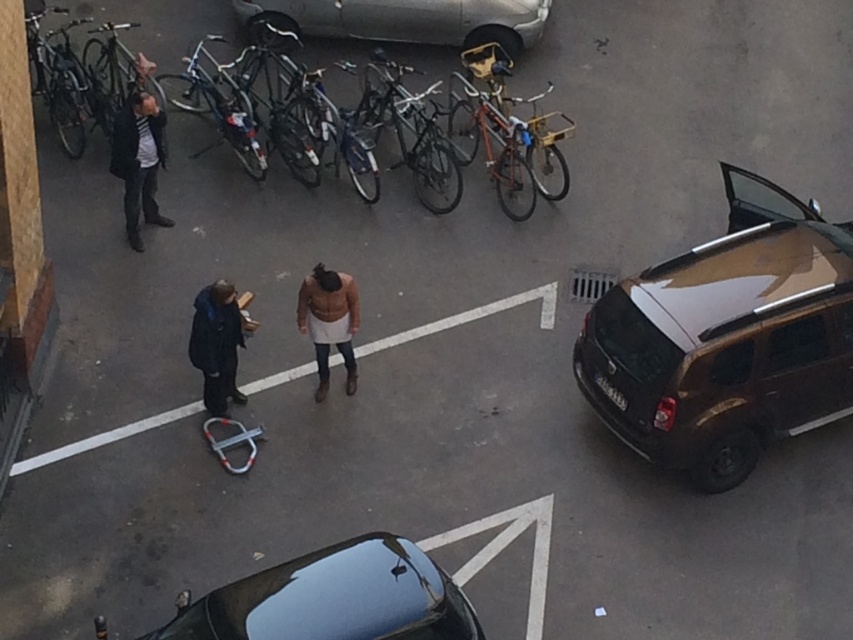
Who is taller, shiny metallic bicycle at left or shiny black car at lower center?

With more height is shiny metallic bicycle at left.

The height and width of the screenshot is (640, 853). I want to click on shiny metallic bicycle at left, so click(376, 35).

In the scene shown: Does dark gray jacket at left appear over dark blue jacket at center?

Correct, dark gray jacket at left is located above dark blue jacket at center.

This screenshot has height=640, width=853. What do you see at coordinates (138, 161) in the screenshot?
I see `dark gray jacket at left` at bounding box center [138, 161].

I want to click on dark gray jacket at left, so click(138, 161).

Who is more forward, (799, 284) or (218, 403)?

Point (799, 284) is in front.

This screenshot has width=853, height=640. What are the coordinates of `shiny brown suv at right` in the screenshot? It's located at pos(726,339).

Who is more forward, (740, 432) or (207, 298)?

Point (207, 298)

You are a GUI agent. You are given a task and a screenshot of the screen. Output one action in this format:
    pyautogui.click(x=<x>, y=<y>)
    Task: Click on the shiny brown suv at right
    
    Given the screenshot: What is the action you would take?
    pyautogui.click(x=726, y=339)